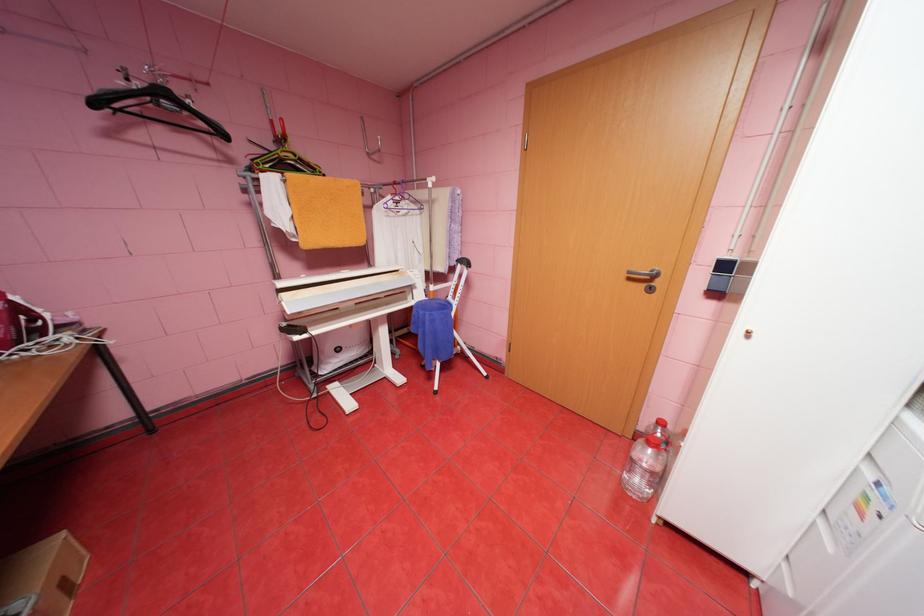
You are a GUI agent. You are given a task and a screenshot of the screen. Output one action in this format:
    pyautogui.click(x=<x>, y=<y>)
    Task: Click on the silver door handle
    The height and width of the screenshot is (616, 924).
    Given the screenshot: What is the action you would take?
    pyautogui.click(x=646, y=278)